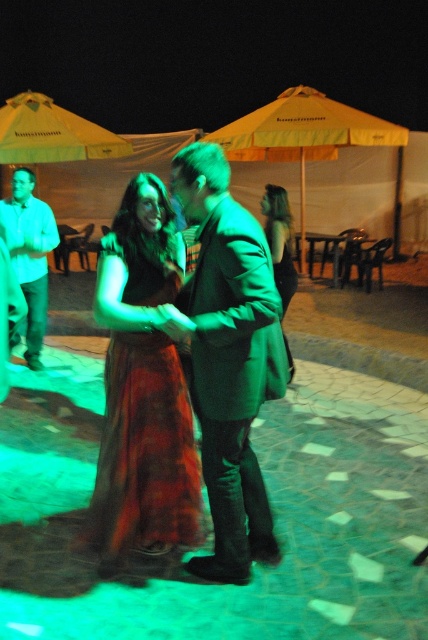
Question: Is yellow fabric umbrella at upper center to the left of yellow fabric umbrella at upper left from the viewer's perspective?

Choices:
 (A) no
 (B) yes

Answer: (A)

Question: Among these objects, which one is nearest to the camera?

Choices:
 (A) velvet rust dress at center
 (B) green matte dress at center

Answer: (A)

Question: Which point appears farthest from the camera in this image?

Choices:
 (A) coord(9,232)
 (B) coord(335,115)
 (C) coord(53,150)

Answer: (B)

Question: Does velvet rust dress at center appear over yellow fabric umbrella at upper left?

Choices:
 (A) no
 (B) yes

Answer: (A)

Question: Can you confirm if matte green dress at center is positioned below yellow fabric umbrella at upper left?

Choices:
 (A) no
 (B) yes

Answer: (B)

Question: Estimate the real-world distances between objects in this image. Which object is closer to the matte white shirt at left?

Choices:
 (A) matte green dress at center
 (B) yellow fabric umbrella at upper left
 (C) green matte dress at center

Answer: (C)